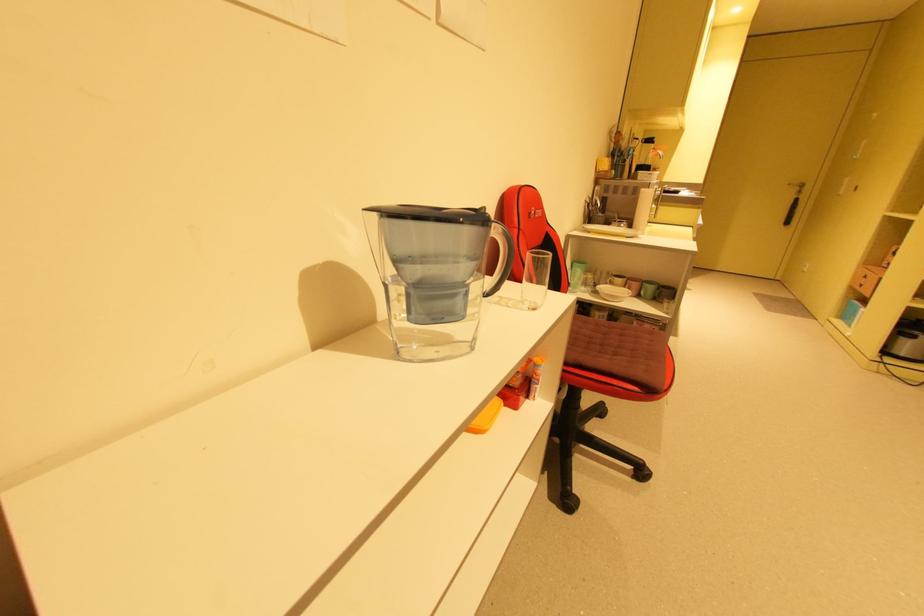
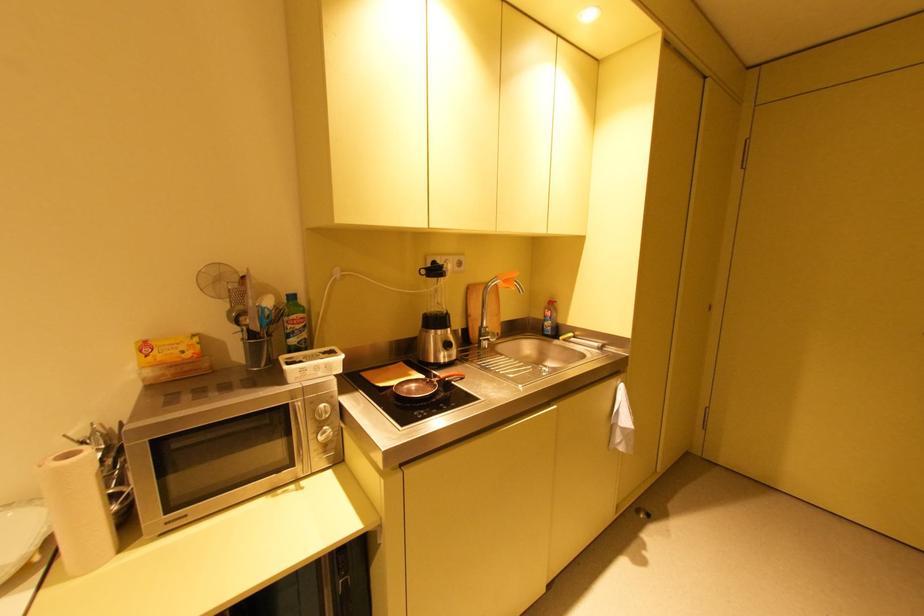
Locate, in the second image, the point that corresponds to the point at 658,139 in the first image.

(444, 267)